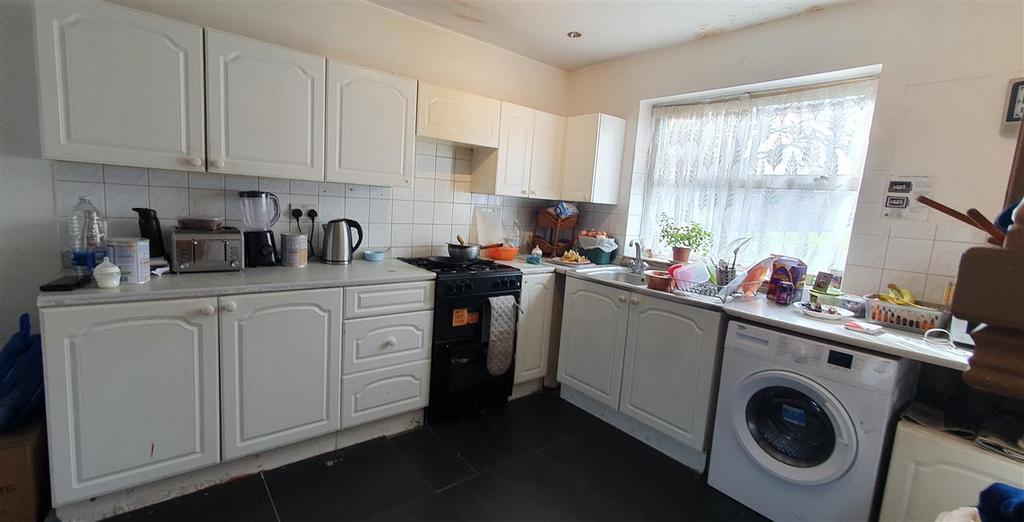
Where is `outlet`? The width and height of the screenshot is (1024, 522). outlet is located at coordinates (305, 208).